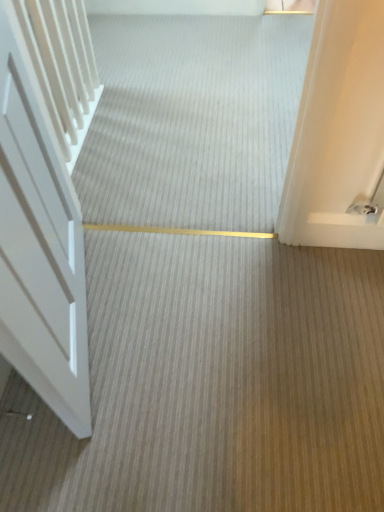
Find the location of `smooth beige carpet at center`. smooth beige carpet at center is located at coordinates (192, 120).

What do you see at coordinates (192, 120) in the screenshot? The image size is (384, 512). I see `smooth beige carpet at center` at bounding box center [192, 120].

Describe the element at coordinates (39, 252) in the screenshot. This screenshot has width=384, height=512. I see `white matte door at left` at that location.

In order to click on white matte door at left in this screenshot , I will do `click(39, 252)`.

This screenshot has height=512, width=384. Find the location of `smooth beige carpet at center`. smooth beige carpet at center is located at coordinates (192, 120).

Between white matte door at left and smooth beige carpet at center, which one appears on the left side from the viewer's perspective?

white matte door at left is more to the left.

In the scene shown: Which is behind, white matte door at left or smooth beige carpet at center?

smooth beige carpet at center.

Does point (65, 296) lie behind point (187, 150)?

No.

From the image's perspective, is white matte door at left located above or below smooth beige carpet at center?

white matte door at left is below smooth beige carpet at center.

Based on the photo, from a real-world perspective, is white matte door at left physically located above or below smooth beige carpet at center?

Clearly, from a real-world perspective, white matte door at left is above smooth beige carpet at center.

Which of these two, white matte door at left or smooth beige carpet at center, is thinner?

white matte door at left is thinner.

Who is shorter, white matte door at left or smooth beige carpet at center?

smooth beige carpet at center.

Does white matte door at left have a smaller size compared to smooth beige carpet at center?

No.

Is white matte door at left inside the boundaries of smooth beige carpet at center, or outside?

The correct answer is: outside.

Are white matte door at left and smooth beige carpet at center beside each other?

No, white matte door at left is not beside smooth beige carpet at center.

Is white matte door at left aimed at smooth beige carpet at center?

No, white matte door at left is not turned towards smooth beige carpet at center.

Identify the location of plain above the white matte door at left (from the image's perspective). (192, 120).

Looking at this image, can you confirm if smooth beige carpet at center is positioned to the right of white matte door at left?

Yes, smooth beige carpet at center is to the right of white matte door at left.

Which is in front, smooth beige carpet at center or white matte door at left?

white matte door at left is closer to the camera.

Is point (79, 169) in front of point (80, 334)?

That is False.

From the image's perspective, is smooth beige carpet at center beneath white matte door at left?

No, from the image's perspective, smooth beige carpet at center is not below white matte door at left.

Consider the image. From a real-world perspective, which is physically above, smooth beige carpet at center or white matte door at left?

From a 3D spatial view, white matte door at left is above.

Looking at their sizes, would you say smooth beige carpet at center is wider or thinner than white matte door at left?

smooth beige carpet at center is wider than white matte door at left.

Can you confirm if smooth beige carpet at center is shorter than white matte door at left?

Indeed, smooth beige carpet at center has a lesser height compared to white matte door at left.

Which of these two, smooth beige carpet at center or white matte door at left, is smaller?

Result: smooth beige carpet at center is smaller.

Is smooth beige carpet at center not within white matte door at left?

Yes, smooth beige carpet at center is outside of white matte door at left.

Is smooth beige carpet at center beside white matte door at left?

No, smooth beige carpet at center is not making contact with white matte door at left.

Is white matte door at left at the back of smooth beige carpet at center?

No, white matte door at left is not at the back of smooth beige carpet at center.

How different are the orientations of smooth beige carpet at center and white matte door at left in degrees?

The angle between the facing direction of smooth beige carpet at center and the facing direction of white matte door at left is 106 degrees.

Identify the location of plain above the white matte door at left (from the image's perspective). (192, 120).

I want to click on door on the left of smooth beige carpet at center, so click(x=39, y=252).

In the image, there is a smooth beige carpet at center. Identify the location of door below it (from the image's perspective). The image size is (384, 512). [x=39, y=252].